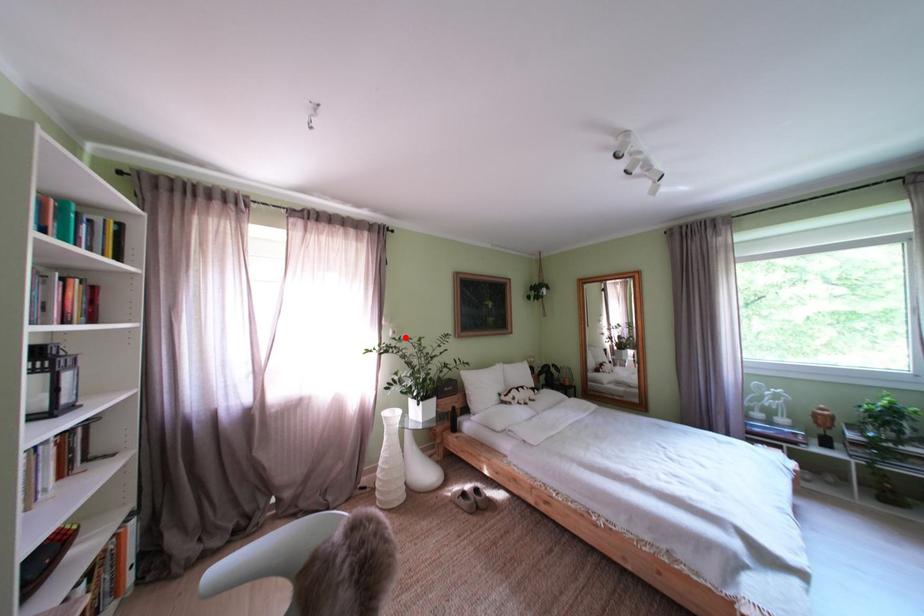
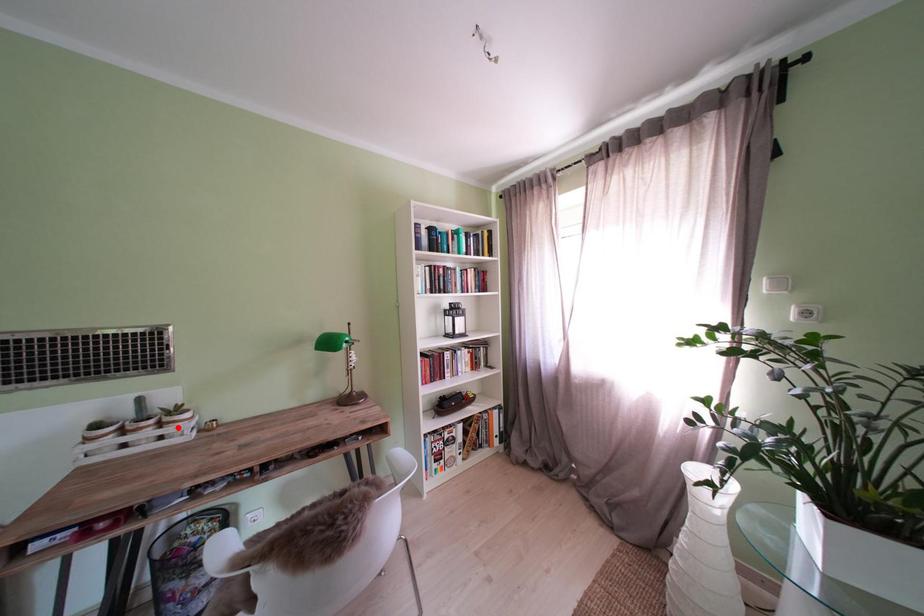
I am providing you with two images of the same scene from different viewpoints. A red point is marked on the first image and another point is marked on the second image. Do the highlighted points in image1 and image2 indicate the same real-world spot?

No